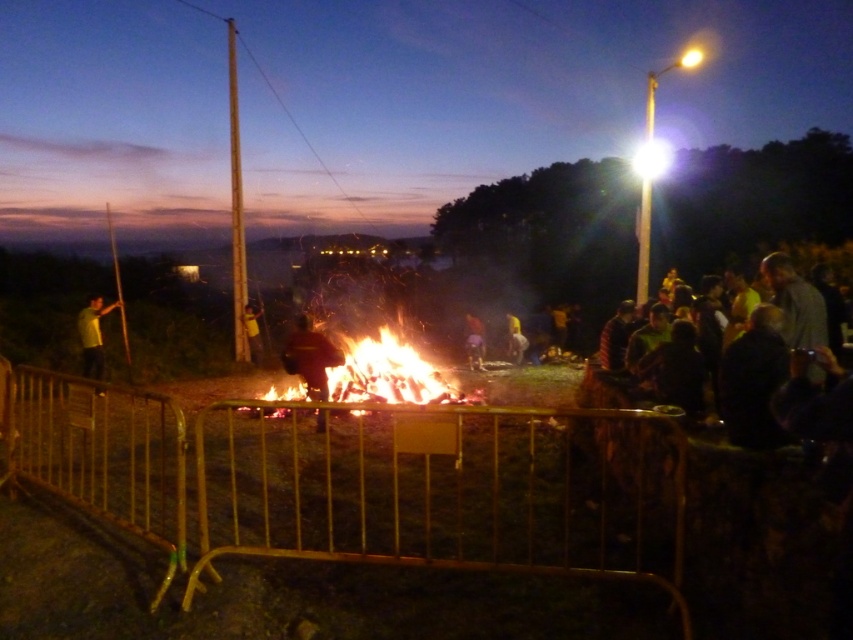
What object is located at the coordinates point [364,372] in the scene?

The point [364,372] corresponds to flaming wood at center.

Looking at this image, you are at an outdoor event and see the flaming wood at center and the yellow fabric at center. Which object is positioned lower in the image?

The flaming wood at center is below the yellow fabric at center, so it is positioned lower in the image.